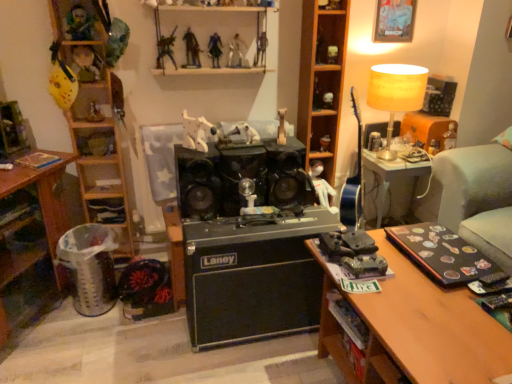
You are a GUI agent. You are given a task and a screenshot of the screen. Output one action in this format:
    pyautogui.click(x=<x>, y=<y>)
    Task: Click on the white matte dog at upper center, arranged as the tenth toy when viewed from the right
    The height and width of the screenshot is (384, 512).
    Given the screenshot: What is the action you would take?
    pyautogui.click(x=197, y=132)

I want to click on white matte figurine at upper center, the second toy in the right-to-left sequence, so click(x=328, y=100).

Describe the element at coordinates (80, 23) in the screenshot. I see `green plastic toy at upper left, which ranks as the 13th toy in right-to-left order` at that location.

What is the approximate width of green plastic toy at upper left, the third toy viewed from the left?

green plastic toy at upper left, the third toy viewed from the left, is 3.14 inches wide.

Locate an element on the screen. white matte dog at upper center, which ranks as the 6th toy in left-to-right order is located at coordinates click(197, 132).

Is wooden shelf at center, the 1th shelf from the right, wider or thinner than black matte speaker at center?

wooden shelf at center, the 1th shelf from the right, is thinner than black matte speaker at center.

From the image's perspective, between wooden shelf at center, which ranks as the 5th shelf in left-to-right order, and black matte speaker at center, who is located below?

From the image's view, black matte speaker at center is below.

From a real-world perspective, between wooden shelf at center, the 1th shelf from the right, and black matte speaker at center, who is vertically higher?

In real-world perspective, wooden shelf at center, the 1th shelf from the right, is above.

Looking at this image, is wooden shelf at center, which ranks as the 5th shelf in left-to-right order, positioned with its back to black matte speaker at center?

No, black matte speaker at center is not at the back of wooden shelf at center, which ranks as the 5th shelf in left-to-right order.

Is metallic silver desk at lower left further to camera compared to white matte toy at center, which is the ninth toy from left to right?

No, it is not.

Is metallic silver desk at lower left inside or outside of white matte toy at center, which is the ninth toy from left to right?

metallic silver desk at lower left is spatially situated outside white matte toy at center, which is the ninth toy from left to right.

Consider the image. From the image's perspective, which is below, metallic silver desk at lower left or white matte toy at center, which is the ninth toy from left to right?

metallic silver desk at lower left appears lower in the image.

How different are the orientations of metallic silver toy at right, which is counted as the 1th toy, starting from the right, and smooth plastic toy at center, arranged as the 12th toy when viewed from the left, in degrees?

The angular difference between metallic silver toy at right, which is counted as the 1th toy, starting from the right, and smooth plastic toy at center, arranged as the 12th toy when viewed from the left, is 0.454 degrees.

Starting from the metallic silver toy at right, which is counted as the 1th toy, starting from the right, which toy is the 4th one in front? Please provide its 2D coordinates.

[(331, 5)]

From a real-world perspective, who is located lower, metallic silver toy at right, which is counted as the fifteenth toy, starting from the left, or smooth plastic toy at center, which appears as the 4th toy when viewed from the right?

In real-world perspective, metallic silver toy at right, which is counted as the fifteenth toy, starting from the left, is lower.

Is metallic silver toy at right, which is counted as the fifteenth toy, starting from the left, taller than smooth plastic toy at center, arranged as the 12th toy when viewed from the left?

Yes.

From a real-world perspective, which is physically below, white matte figurine at upper center, the second toy in the right-to-left sequence, or wooden shelf at center, the 1th shelf from the right?

From a 3D spatial view, white matte figurine at upper center, the second toy in the right-to-left sequence, is below.

Would you consider white matte figurine at upper center, the second toy in the right-to-left sequence, to be distant from wooden shelf at center, which ranks as the 5th shelf in left-to-right order?

Actually, white matte figurine at upper center, the second toy in the right-to-left sequence, and wooden shelf at center, which ranks as the 5th shelf in left-to-right order, are a little close together.

What's the angular difference between white matte figurine at upper center, acting as the fourteenth toy starting from the left, and wooden shelf at center, which ranks as the 5th shelf in left-to-right order,'s facing directions?

The facing directions of white matte figurine at upper center, acting as the fourteenth toy starting from the left, and wooden shelf at center, which ranks as the 5th shelf in left-to-right order, are 4.62 degrees apart.

Between white matte figurine at upper center, acting as the fourteenth toy starting from the left, and wooden shelf at center, the 1th shelf from the right, which one has less height?

white matte figurine at upper center, acting as the fourteenth toy starting from the left, is shorter.

From the image's perspective, is smooth plastic toy at center, which appears as the 4th toy when viewed from the right, located above wooden shelf at upper left, arranged as the 5th shelf when viewed from the right?

Yes, from the image's perspective, smooth plastic toy at center, which appears as the 4th toy when viewed from the right, is above wooden shelf at upper left, arranged as the 5th shelf when viewed from the right.

Locate an element on the screen. toy that is the 3rd one when counting backward from the wooden shelf at upper left, arranged as the 5th shelf when viewed from the right is located at coordinates (331, 5).

Considering the relative positions of smooth plastic toy at center, arranged as the 12th toy when viewed from the left, and wooden shelf at upper left, arranged as the 5th shelf when viewed from the right, in the image provided, is smooth plastic toy at center, arranged as the 12th toy when viewed from the left, behind wooden shelf at upper left, arranged as the 5th shelf when viewed from the right,?

Yes, smooth plastic toy at center, arranged as the 12th toy when viewed from the left, is further from the camera.

Which object is thinner, smooth plastic toy at center, which appears as the 4th toy when viewed from the right, or wooden shelf at upper left, arranged as the 5th shelf when viewed from the right?

With smaller width is smooth plastic toy at center, which appears as the 4th toy when viewed from the right.

Can you confirm if metallic silver desk at lower left is thinner than metallic silver action figure at upper center, acting as the tenth toy starting from the left?

Incorrect, the width of metallic silver desk at lower left is not less than that of metallic silver action figure at upper center, acting as the tenth toy starting from the left.

From a real-world perspective, which is physically above, metallic silver desk at lower left or metallic silver action figure at upper center, acting as the tenth toy starting from the left?

From a 3D spatial view, metallic silver action figure at upper center, acting as the tenth toy starting from the left, is above.

Is metallic silver desk at lower left with metallic silver action figure at upper center, acting as the tenth toy starting from the left?

No, metallic silver desk at lower left is not touching metallic silver action figure at upper center, acting as the tenth toy starting from the left.

Who is smaller, metallic silver desk at lower left or metallic silver action figure at upper center, which appears as the sixth toy when viewed from the right?

metallic silver action figure at upper center, which appears as the sixth toy when viewed from the right.

Can we say metallic silver figure at upper center, the eighth toy when ordered from right to left, lies outside matte plastic figurine at upper left, which is the second toy in left-to-right order?

Yes, metallic silver figure at upper center, the eighth toy when ordered from right to left, is not within matte plastic figurine at upper left, which is the second toy in left-to-right order.

Are metallic silver figure at upper center, the eighth toy when ordered from right to left, and matte plastic figurine at upper left, which is the second toy in left-to-right order, located far from each other?

No, metallic silver figure at upper center, the eighth toy when ordered from right to left, is not far away from matte plastic figurine at upper left, which is the second toy in left-to-right order.

In the scene shown: How many degrees apart are the facing directions of metallic silver figure at upper center, the eighth toy when ordered from right to left, and matte plastic figurine at upper left, acting as the fourteenth toy starting from the right?

They differ by 0.000802 degrees in their facing directions.

Identify the location of the 3rd shelf positioned above the black matte speaker at center (from the image's perspective). (321, 82).

Identify the location of desk directly beneath the white matte toy at center, arranged as the 7th toy when viewed from the right (from a real-world perspective). pyautogui.click(x=42, y=193).

Based on their spatial positions, is metallic silver figure at upper center, the 8th toy when ordered from left to right, or metallic silver picture frame at upper right further from gray fabric swivel chair at right?

metallic silver figure at upper center, the 8th toy when ordered from left to right, is positioned further to the anchor gray fabric swivel chair at right.

When comparing their distances from metallic silver picture frame at upper right, does shiny plastic figure at upper center, which is the ninth toy in right-to-left order, or smooth plastic toy at center, which appears as the 4th toy when viewed from the right, seem closer?

smooth plastic toy at center, which appears as the 4th toy when viewed from the right, is closer to metallic silver picture frame at upper right.

Considering their positions, is matte plastic figurine at upper left, which is the second toy in left-to-right order, positioned further to white matte toy at center, arranged as the 7th toy when viewed from the right, than green matte toy tank at center, which is the 11th toy from left to right?

green matte toy tank at center, which is the 11th toy from left to right.

In the scene shown: Based on their spatial positions, is metallic figure at upper center, the 11th toy viewed from the right, or metallic silver toy at right, which is counted as the fifteenth toy, starting from the left, further from matte plastic toy at upper center, acting as the 13th toy starting from the left?

metallic silver toy at right, which is counted as the fifteenth toy, starting from the left, is further to matte plastic toy at upper center, acting as the 13th toy starting from the left.

Looking at the image, which one is located closer to metallic silver toy at right, which is counted as the 1th toy, starting from the right, metallic silver desk at lower left or metallic silver figure at upper center, the 8th toy when ordered from left to right?

metallic silver figure at upper center, the 8th toy when ordered from left to right, is closer to metallic silver toy at right, which is counted as the 1th toy, starting from the right.

Which object lies nearer to the anchor point green matte toy tank at center, which is the 11th toy from left to right, metallic silver action figure at upper center, acting as the tenth toy starting from the left, or shiny plastic figure at upper center, positioned as the seventh toy in left-to-right order?

Based on the image, metallic silver action figure at upper center, acting as the tenth toy starting from the left, appears to be nearer to green matte toy tank at center, which is the 11th toy from left to right.

Which object lies nearer to the anchor point white matte shelf at upper center, acting as the 2th shelf starting from the right, metallic silver robot at upper center, which is the fourth toy from left to right, or wooden shelf at center, the 1th shelf from the right?

metallic silver robot at upper center, which is the fourth toy from left to right, is closer to white matte shelf at upper center, acting as the 2th shelf starting from the right.

Looking at the image, which one is located further to white matte shelf at upper center, acting as the 2th shelf starting from the right, metallic silver robot at upper center, the 12th toy from the right, or white matte toy at center, arranged as the 7th toy when viewed from the right?

Among the two, white matte toy at center, arranged as the 7th toy when viewed from the right, is located further to white matte shelf at upper center, acting as the 2th shelf starting from the right.

Locate an element on the screen. loudspeaker located between metallic figure at upper center, the 11th toy viewed from the right, and metallic silver picture frame at upper right in the left-right direction is located at coordinates (241, 178).

This screenshot has width=512, height=384. Find the location of `picture frame between matte plastic figurine at upper left, acting as the fourteenth toy starting from the right, and metallic silver toy at right, which is counted as the fifteenth toy, starting from the left, in the horizontal direction`. picture frame between matte plastic figurine at upper left, acting as the fourteenth toy starting from the right, and metallic silver toy at right, which is counted as the fifteenth toy, starting from the left, in the horizontal direction is located at coordinates (394, 21).

In order to click on picture frame located between metallic figure at upper center, the fifth toy in the left-to-right sequence, and gray fabric swivel chair at right in the left-right direction in this screenshot , I will do `click(394, 21)`.

I want to click on shelf between white matte toy at center, arranged as the 7th toy when viewed from the right, and metallic silver toy at right, which is counted as the 1th toy, starting from the right, in the horizontal direction, so click(321, 82).